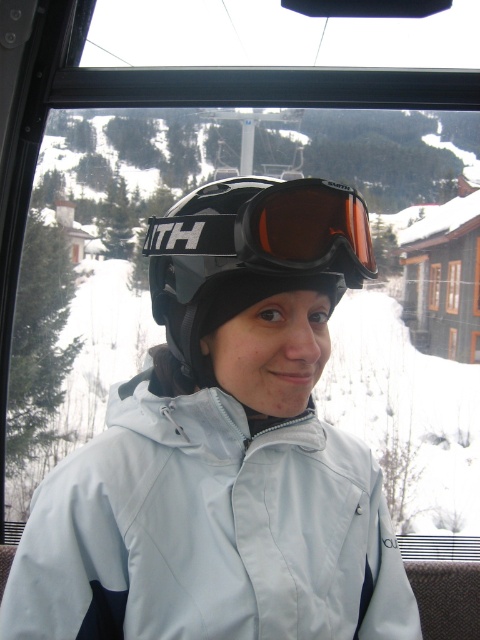
Question: Which point is farther from the camera taking this photo?

Choices:
 (A) (328, 216)
 (B) (166, 244)
 (C) (348, 632)

Answer: (C)

Question: Does light blue fabric jacket at center appear over black matte helmet at center?

Choices:
 (A) no
 (B) yes

Answer: (A)

Question: Which point appears farthest from the camera in this image?

Choices:
 (A) coord(158,360)
 (B) coord(229,236)

Answer: (A)

Question: Which of the following is the closest to the observer?

Choices:
 (A) (283, 272)
 (B) (356, 284)

Answer: (A)

Question: Where is light blue fabric jacket at center located in relation to black matte helmet at center in the image?

Choices:
 (A) below
 (B) above

Answer: (A)

Question: Does black matte helmet at center appear under matte orange lens at center?

Choices:
 (A) no
 (B) yes

Answer: (B)